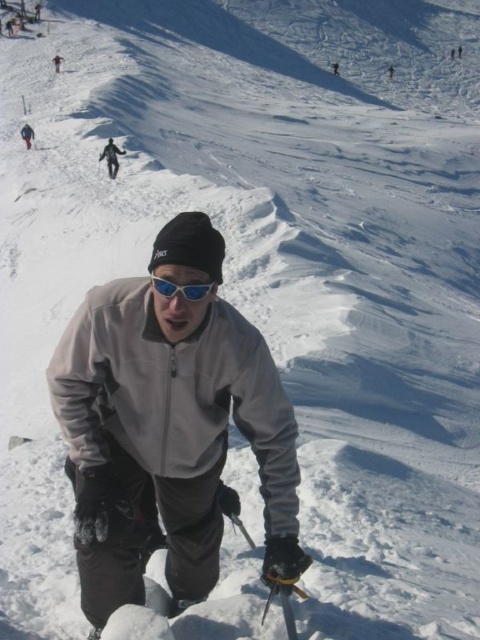
Question: Among these points, which one is nearest to the camera?

Choices:
 (A) (197, 298)
 (B) (163, 314)

Answer: (A)

Question: Considering the relative positions of gray fleece jacket at center and blue reflective lens goggles at center in the image provided, where is gray fleece jacket at center located with respect to blue reflective lens goggles at center?

Choices:
 (A) above
 (B) below

Answer: (B)

Question: Does gray fleece jacket at center appear over blue reflective lens goggles at center?

Choices:
 (A) yes
 (B) no

Answer: (B)

Question: Which of the following is the farthest from the observer?

Choices:
 (A) gray fleece jacket at center
 (B) gray matte jacket at upper center

Answer: (B)

Question: Is blue reflective lens goggles at center positioned before gray matte jacket at upper center?

Choices:
 (A) yes
 (B) no

Answer: (A)

Question: Which point is farther to the camera?

Choices:
 (A) (141, 412)
 (B) (115, 157)
 (C) (184, 298)

Answer: (B)